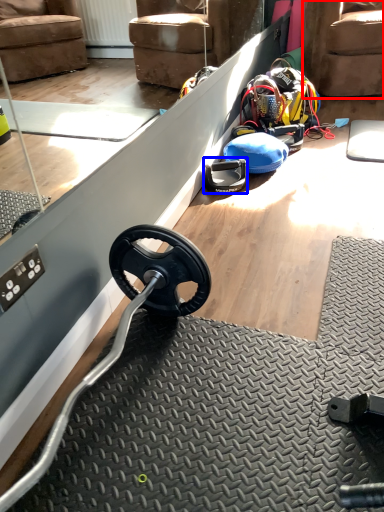
Question: Which point is further to the camera, armchair (highlighted by a red box) or wheel (highlighted by a blue box)?

Choices:
 (A) armchair
 (B) wheel

Answer: (A)